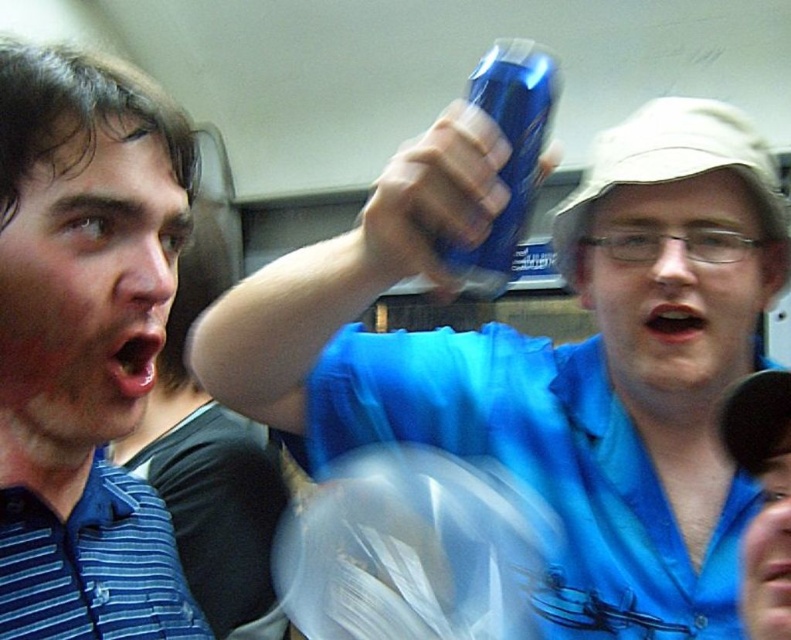
Question: Does blue glossy can at upper center have a larger size compared to blue striped polo shirt at left?

Choices:
 (A) yes
 (B) no

Answer: (A)

Question: Among these objects, which one is nearest to the camera?

Choices:
 (A) blue plastic can at upper center
 (B) blue glossy can at upper center
 (C) blue striped polo shirt at left

Answer: (C)

Question: Which of the following is the farthest from the observer?

Choices:
 (A) (10, 84)
 (B) (428, 250)

Answer: (B)

Question: Can you confirm if blue glossy can at upper center is positioned below blue striped polo shirt at left?

Choices:
 (A) no
 (B) yes

Answer: (A)

Question: Can you confirm if blue glossy can at upper center is positioned below blue plastic can at upper center?

Choices:
 (A) yes
 (B) no

Answer: (A)

Question: Which object is closer to the camera taking this photo?

Choices:
 (A) blue glossy can at upper center
 (B) blue plastic can at upper center

Answer: (A)